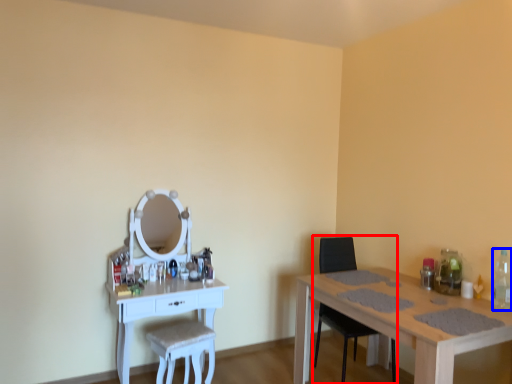
Question: Which of the following is the closest to the observer, chair (highlighted by a red box) or bottle (highlighted by a blue box)?

Choices:
 (A) chair
 (B) bottle

Answer: (B)